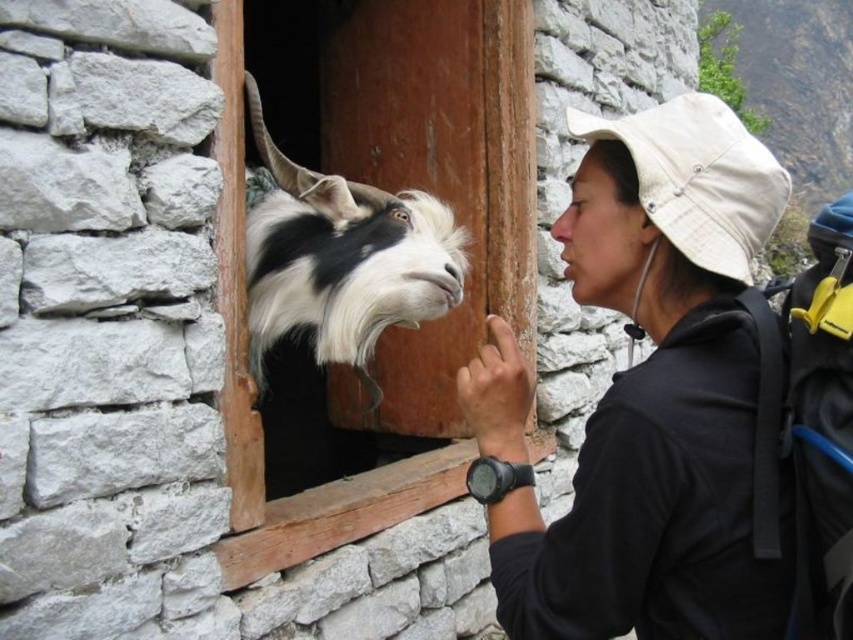
Looking at this image, you are standing outside the rustic stone building and see the black and white fur at window center and the pink smooth skin at center. Which object is positioned to the left of the other?

The black and white fur at window center is to the left of the pink smooth skin at center.

You are a photographer trying to capture a portrait of the pink smooth skin at center while avoiding the black matte hat at upper right. Since the hat is blocking part of the view, can you lower your camera slightly to frame the subject better?

The black matte hat at upper right is much taller than the pink smooth skin at center, so lowering the camera might help frame the subject better by moving the hat out of the way.

You are a delivery person trying to hand a package to someone through the wooden door at center. The package is wrapped in pink smooth skin at center. Can you fit the package through the door without damaging it?

The wooden door at center is wider than the pink smooth skin at center, so the package can be passed through without any issues as long as the orientation allows for the width to fit.